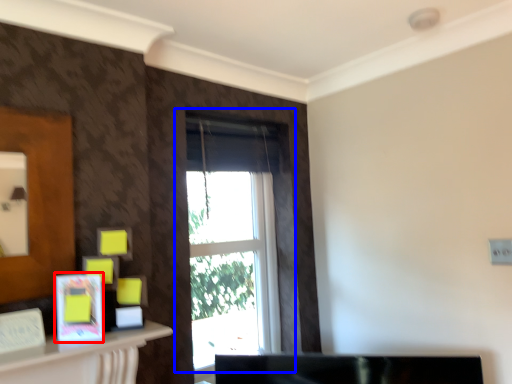
Question: Which point is further to the camera, picture frame (highlighted by a red box) or window (highlighted by a blue box)?

Choices:
 (A) picture frame
 (B) window

Answer: (B)